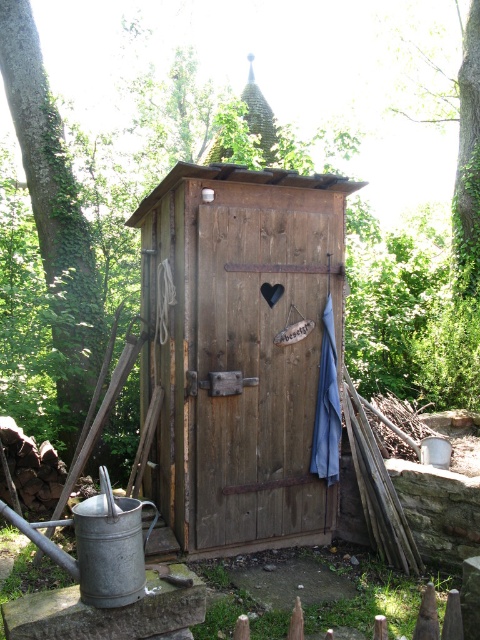
You are planning to build a fence around the wooden hut at center and the green leafy tree at left. Which structure requires a wider fence to accommodate its width?

The wooden hut at center requires a wider fence because its width surpasses that of the green leafy tree at left.

You are standing at the origin point in the image. Which direction should you move to reach the wooden hut at center?

Since the wooden hut at center is located at point 0.545 on the x axis and 0.498 on the y axis, you should move towards the center of the image to reach it.

You are planning to build a small shed next to the wooden hut at center and the green leafy tree at left. Based on their sizes, which one would require more materials for construction?

The wooden hut at center is larger in size than the green leafy tree at left, so it would require more materials for construction.